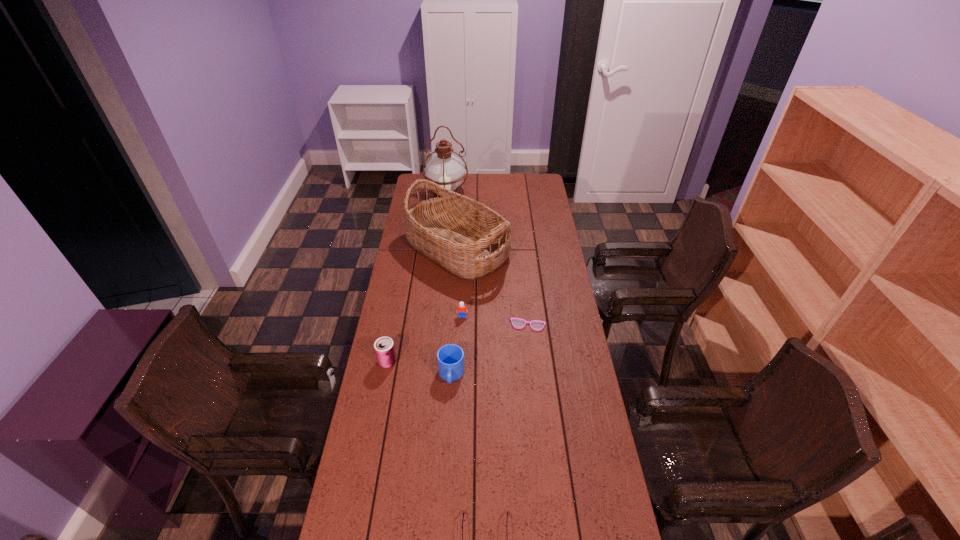
Identify the location of vacant space located 0.190m on the right of the tallest object. (501, 191).

Find the location of a particular element. free space located on the right of the second farthest object is located at coordinates (531, 249).

Image resolution: width=960 pixels, height=540 pixels. I want to click on vacant region located 0.230m on the front of the right spectacles, so click(534, 380).

Identify the location of vacant space located on the right of the can. The image size is (960, 540). (498, 362).

The width and height of the screenshot is (960, 540). What are the coordinates of `free space located on the side of the mug with the handle` in the screenshot? It's located at (448, 429).

The image size is (960, 540). Identify the location of vacant region located on the face of the fifth nearest object. pos(462,330).

Locate an element on the screen. This screenshot has height=540, width=960. object present at the far edge is located at coordinates (444, 169).

The width and height of the screenshot is (960, 540). Identify the location of oil lamp at the left edge. (444, 169).

I want to click on basket positioned at the left edge, so click(467, 238).

This screenshot has width=960, height=540. Find the location of `can located at the left edge`. can located at the left edge is located at coordinates (384, 348).